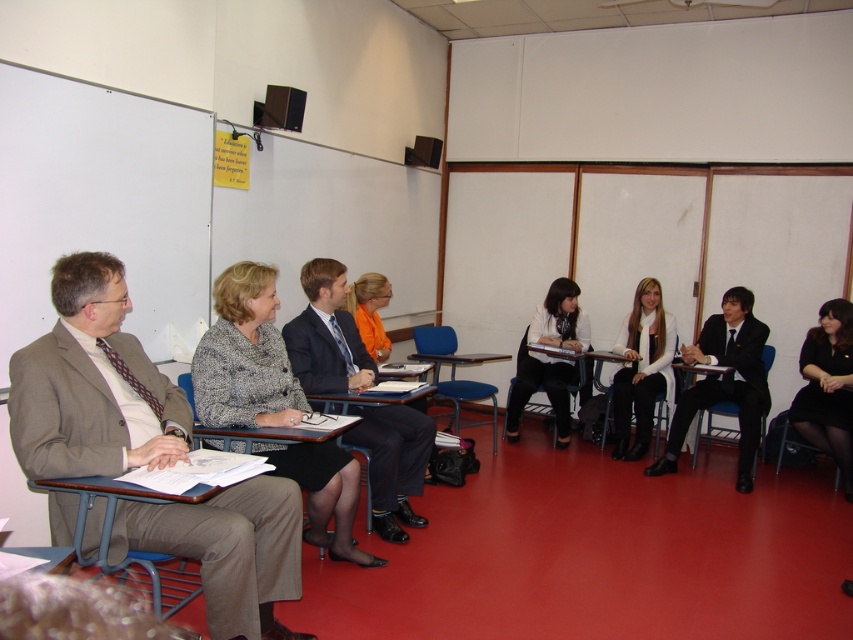
Is the position of dark blue suit at center more distant than that of wooden desk at center?

No, it is in front of wooden desk at center.

Who is positioned more to the left, dark blue suit at center or wooden desk at center?

From the viewer's perspective, dark blue suit at center appears more on the left side.

Locate an element on the screen. dark blue suit at center is located at coordinates (326, 333).

Who is shorter, black suit at center or orange fabric jacket at center?

With less height is orange fabric jacket at center.

Is black suit at center wider than orange fabric jacket at center?

Yes, black suit at center is wider than orange fabric jacket at center.

Where is `black suit at center`? black suit at center is located at coordinates (724, 381).

Does light brown suit at left come behind white matte scarf at center?

No, light brown suit at left is in front of white matte scarf at center.

Between light brown suit at left and white matte scarf at center, which one has less height?

With less height is white matte scarf at center.

What do you see at coordinates (91, 385) in the screenshot? I see `light brown suit at left` at bounding box center [91, 385].

I want to click on light brown suit at left, so click(x=91, y=385).